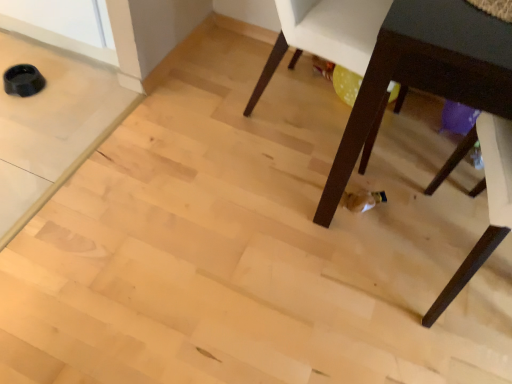
Where is `dark wood table at lower right`? dark wood table at lower right is located at coordinates (425, 74).

The width and height of the screenshot is (512, 384). What do you see at coordinates (325, 34) in the screenshot? I see `white plastic chair at center, arranged as the second chair when ordered from the bottom` at bounding box center [325, 34].

At what (x,y) coordinates should I click in order to perform the action: click on dark wood chair at lower right, arranged as the 2th chair when viewed from the left. Please return your answer as a coordinate pair (x, y). The image size is (512, 384). Looking at the image, I should click on (488, 200).

What do you see at coordinates (488, 200) in the screenshot? I see `dark wood chair at lower right, the first chair viewed from the right` at bounding box center [488, 200].

Locate an element on the screen. The width and height of the screenshot is (512, 384). dark wood table at lower right is located at coordinates (425, 74).

Considering the relative sizes of white plastic chair at center, arranged as the second chair when ordered from the bottom, and dark wood table at lower right in the image provided, is white plastic chair at center, arranged as the second chair when ordered from the bottom, shorter than dark wood table at lower right?

Yes.

Can you confirm if white plastic chair at center, which is the first chair in top-to-bottom order, is thinner than dark wood table at lower right?

Yes.

Where is `the 1st chair directly beneath the dark wood table at lower right (from a real-world perspective)`? the 1st chair directly beneath the dark wood table at lower right (from a real-world perspective) is located at coordinates (325, 34).

Is white plastic chair at center, which is the first chair in top-to-bottom order, placed right next to dark wood chair at lower right, acting as the 1th chair starting from the bottom?

No, white plastic chair at center, which is the first chair in top-to-bottom order, is not beside dark wood chair at lower right, acting as the 1th chair starting from the bottom.

Between white plastic chair at center, arranged as the second chair when ordered from the bottom, and dark wood chair at lower right, acting as the 1th chair starting from the bottom, which one has smaller width?

white plastic chair at center, arranged as the second chair when ordered from the bottom.

Is white plastic chair at center, which is the first chair in top-to-bottom order, oriented away from dark wood chair at lower right, arranged as the 2th chair when viewed from the left?

No, white plastic chair at center, which is the first chair in top-to-bottom order,'s orientation is not away from dark wood chair at lower right, arranged as the 2th chair when viewed from the left.

In the scene shown: Does white plastic chair at center, arranged as the second chair when ordered from the bottom, lie in front of dark wood chair at lower right, arranged as the 2th chair when viewed from the left?

No, it is behind dark wood chair at lower right, arranged as the 2th chair when viewed from the left.

From the picture: Who is taller, dark wood table at lower right or dark wood chair at lower right, acting as the 1th chair starting from the bottom?

dark wood table at lower right.

In the image, there is a dark wood chair at lower right, the second chair from the top. Where is `table above it (from the image's perspective)`? table above it (from the image's perspective) is located at coordinates (425, 74).

Which point is more forward, (451,28) or (499,133)?

The point (451,28) is in front.

From a real-world perspective, which object rests below the other?

dark wood chair at lower right, arranged as the 2th chair when viewed from the left, is physically lower.

How distant is dark wood chair at lower right, the first chair viewed from the right, from white plastic chair at center, acting as the 2th chair starting from the right?

dark wood chair at lower right, the first chair viewed from the right, is 23.06 inches away from white plastic chair at center, acting as the 2th chair starting from the right.

Is dark wood chair at lower right, the first chair viewed from the right, further to camera compared to white plastic chair at center, arranged as the second chair when ordered from the bottom?

No, it is in front of white plastic chair at center, arranged as the second chair when ordered from the bottom.

Which object is thinner, dark wood chair at lower right, the second chair from the top, or white plastic chair at center, which is the first chair in top-to-bottom order?

white plastic chair at center, which is the first chair in top-to-bottom order.

Is dark wood chair at lower right, acting as the 1th chair starting from the bottom, far from white plastic chair at center, acting as the 2th chair starting from the right?

No, there isn't a large distance between dark wood chair at lower right, acting as the 1th chair starting from the bottom, and white plastic chair at center, acting as the 2th chair starting from the right.

Considering the relative sizes of dark wood table at lower right and white plastic chair at center, arranged as the second chair when ordered from the bottom, in the image provided, is dark wood table at lower right smaller than white plastic chair at center, arranged as the second chair when ordered from the bottom,?

Incorrect, dark wood table at lower right is not smaller in size than white plastic chair at center, arranged as the second chair when ordered from the bottom.

Is dark wood table at lower right in front of white plastic chair at center, arranged as the second chair when ordered from the bottom?

Yes, dark wood table at lower right is closer to the camera.

Is point (436, 34) closer or farther from the camera than point (356, 21)?

Clearly, point (436, 34) is closer to the camera than point (356, 21).

Are dark wood chair at lower right, acting as the 1th chair starting from the bottom, and dark wood table at lower right beside each other?

No, dark wood chair at lower right, acting as the 1th chair starting from the bottom, is not with dark wood table at lower right.

Is dark wood chair at lower right, the second chair from the top, shorter than dark wood table at lower right?

Indeed, dark wood chair at lower right, the second chair from the top, has a lesser height compared to dark wood table at lower right.

Is point (502, 216) behind point (499, 97)?

Yes, point (502, 216) is farther from viewer.

How far apart are dark wood chair at lower right, the second chair from the top, and dark wood table at lower right?

dark wood chair at lower right, the second chair from the top, is 12.07 inches from dark wood table at lower right.

Identify the location of table above the white plastic chair at center, arranged as the second chair when ordered from the bottom (from a real-world perspective). This screenshot has height=384, width=512. (425, 74).

Identify the location of chair that appears above the dark wood chair at lower right, the first chair viewed from the right (from the image's perspective). (325, 34).

Which object lies nearer to the anchor point dark wood table at lower right, white plastic chair at center, acting as the 2th chair starting from the right, or dark wood chair at lower right, arranged as the 2th chair when viewed from the left?

The object closer to dark wood table at lower right is dark wood chair at lower right, arranged as the 2th chair when viewed from the left.

Consider the image. Looking at the image, which one is located closer to white plastic chair at center, acting as the 2th chair starting from the right, dark wood chair at lower right, the second chair from the top, or dark wood table at lower right?

The object closer to white plastic chair at center, acting as the 2th chair starting from the right, is dark wood table at lower right.

Estimate the real-world distances between objects in this image. Which object is further from dark wood chair at lower right, arranged as the 2th chair when viewed from the left, dark wood table at lower right or white plastic chair at center, acting as the 2th chair starting from the right?

white plastic chair at center, acting as the 2th chair starting from the right, lies further to dark wood chair at lower right, arranged as the 2th chair when viewed from the left, than the other object.

From the image, which object appears to be farther from dark wood chair at lower right, arranged as the 2th chair when viewed from the left, white plastic chair at center, which is the first chair in top-to-bottom order, or dark wood table at lower right?

Among the two, white plastic chair at center, which is the first chair in top-to-bottom order, is located further to dark wood chair at lower right, arranged as the 2th chair when viewed from the left.

When comparing their distances from white plastic chair at center, which is the first chair in top-to-bottom order, does dark wood table at lower right or dark wood chair at lower right, acting as the 1th chair starting from the bottom, seem further?

dark wood chair at lower right, acting as the 1th chair starting from the bottom, is positioned further to the anchor white plastic chair at center, which is the first chair in top-to-bottom order.

Looking at this image, from the image, which object appears to be farther from dark wood table at lower right, dark wood chair at lower right, the first chair viewed from the right, or white plastic chair at center, arranged as the second chair when ordered from the bottom?

white plastic chair at center, arranged as the second chair when ordered from the bottom, lies further to dark wood table at lower right than the other object.

This screenshot has height=384, width=512. What are the coordinates of `table that lies between white plastic chair at center, acting as the 2th chair starting from the right, and dark wood chair at lower right, arranged as the 2th chair when viewed from the left, from top to bottom` in the screenshot? It's located at (425, 74).